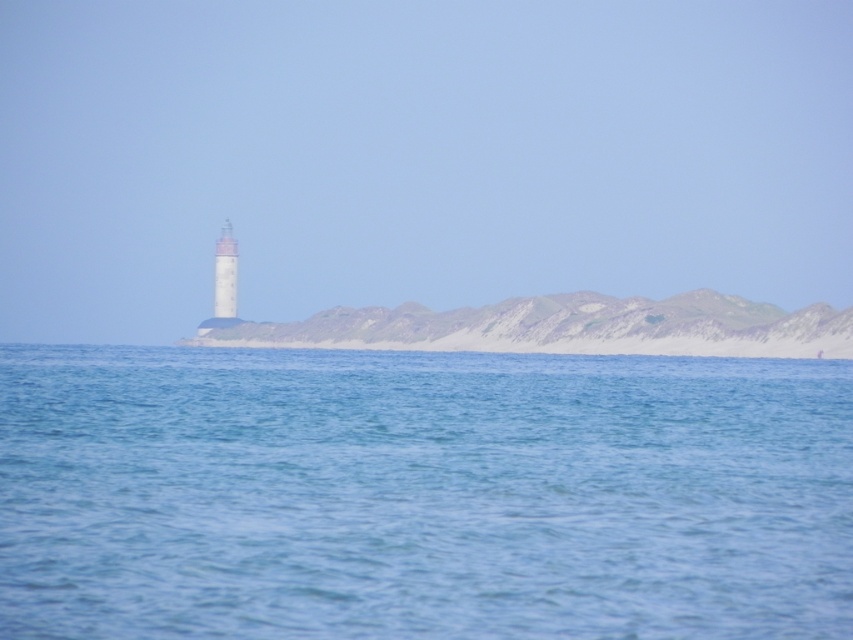
You are standing at the lighthouse on the peninsula. You see a point marked at coordinates (x=421, y=493). What is located at that point?

The point at coordinates (x=421, y=493) marks blue water at center.

You are a photographer planning to capture the entire scene of the blue water at center and rugged sand dunes at center in one shot. Based on their widths, which area would require you to zoom out more to include its full view?

The rugged sand dunes at center require zooming out more because they are wider than the blue water at center.

You are standing at the lighthouse on the peninsula and want to reach the blue water at center. Which direction should you walk to get there?

The blue water at center is located at point 0.773 on the x and 0.495 on the y coordinate. Since the lighthouse is on the peninsula, you should walk towards the direction of the blue water at center to reach it.